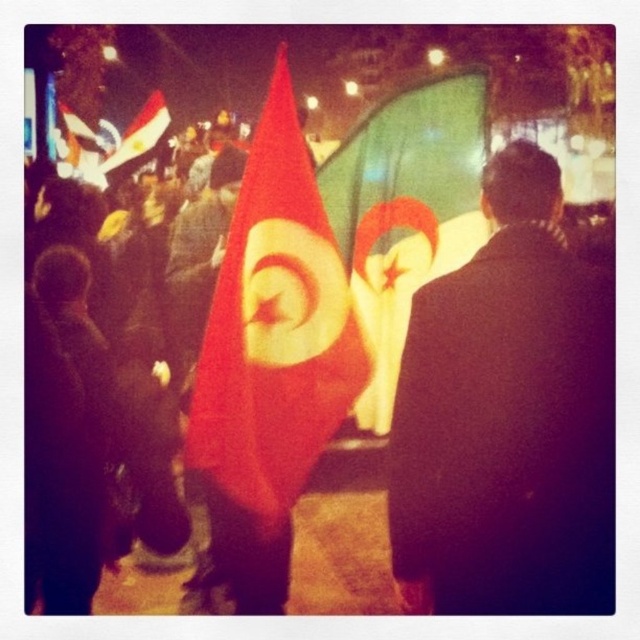
You are a photographer at the event and want to capture a closeup of the dark wool coat at center. According to the coordinates provided, where should you aim your camera?

You should aim your camera at point 0.652 on the x axis and 0.794 on the y axis to capture the dark wool coat at center.